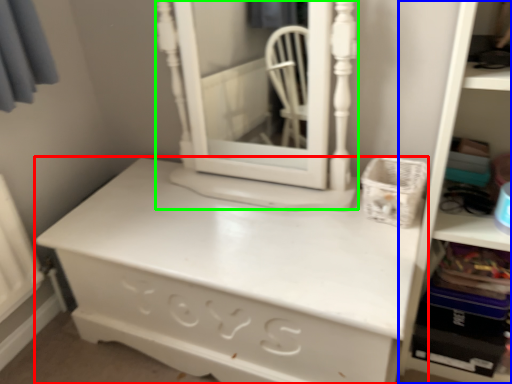
Question: Based on their relative distances, which object is farther from chest of drawers (highlighted by a red box)? Choose from bookshelf (highlighted by a blue box) and medicine cabinet (highlighted by a green box).

Choices:
 (A) bookshelf
 (B) medicine cabinet

Answer: (B)